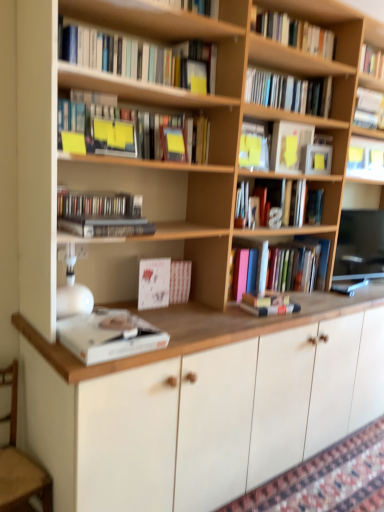
Question: Is wooden armchair at lower left placed right next to matte black compact disc case at left, acting as the 8th book starting from the top?

Choices:
 (A) no
 (B) yes

Answer: (A)

Question: From the image's perspective, would you say wooden armchair at lower left is shown under matte black compact disc case at left, the fifth book when ordered from bottom to top?

Choices:
 (A) no
 (B) yes

Answer: (B)

Question: Is the position of wooden armchair at lower left more distant than that of matte black compact disc case at left, acting as the 8th book starting from the top?

Choices:
 (A) no
 (B) yes

Answer: (A)

Question: Can you confirm if wooden armchair at lower left is smaller than matte black compact disc case at left, the fifth book when ordered from bottom to top?

Choices:
 (A) yes
 (B) no

Answer: (B)

Question: Does wooden armchair at lower left have a lesser height compared to matte black compact disc case at left, the fifth book when ordered from bottom to top?

Choices:
 (A) no
 (B) yes

Answer: (A)

Question: Looking at their shapes, would you say hardcover book at upper right, the 1th book in the top-to-bottom sequence, is wider or thinner than white textured book at center, the third book positioned from the bottom?

Choices:
 (A) thin
 (B) wide

Answer: (B)

Question: Would you say hardcover book at upper right, the 12th book ordered from the bottom, is to the left or to the right of white textured book at center, the third book positioned from the bottom, in the picture?

Choices:
 (A) left
 (B) right

Answer: (B)

Question: From the image's perspective, is hardcover book at upper right, the 1th book in the top-to-bottom sequence, positioned above or below white textured book at center, acting as the tenth book starting from the top?

Choices:
 (A) below
 (B) above

Answer: (B)

Question: Which is correct: hardcover book at upper right, the 12th book ordered from the bottom, is inside white textured book at center, acting as the tenth book starting from the top, or outside of it?

Choices:
 (A) inside
 (B) outside

Answer: (B)

Question: Considering the positions of wooden armchair at lower left and hardcover book at center, which is the eleventh book from top to bottom, in the image, is wooden armchair at lower left bigger or smaller than hardcover book at center, which is the eleventh book from top to bottom,?

Choices:
 (A) small
 (B) big

Answer: (B)

Question: In terms of height, does wooden armchair at lower left look taller or shorter compared to hardcover book at center, which is the eleventh book from top to bottom?

Choices:
 (A) short
 (B) tall

Answer: (B)

Question: From a real-world perspective, is wooden armchair at lower left positioned above or below hardcover book at center, which is the eleventh book from top to bottom?

Choices:
 (A) above
 (B) below

Answer: (B)

Question: Would you say wooden armchair at lower left is to the left or to the right of hardcover book at center, which is counted as the 2th book, starting from the bottom, in the picture?

Choices:
 (A) left
 (B) right

Answer: (A)

Question: Is matte black compact disc case at left, acting as the 8th book starting from the top, taller or shorter than hardcover book at center, which is counted as the 2th book, starting from the bottom?

Choices:
 (A) short
 (B) tall

Answer: (B)

Question: In the image, is matte black compact disc case at left, the fifth book when ordered from bottom to top, on the left side or the right side of hardcover book at center, which is counted as the 2th book, starting from the bottom?

Choices:
 (A) right
 (B) left

Answer: (B)